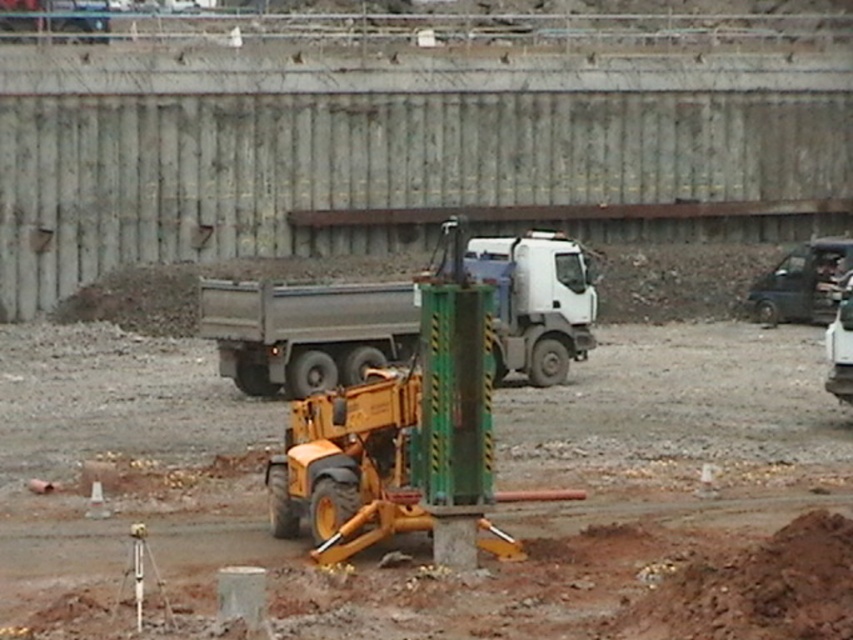
Question: Can you confirm if gray metallic trailer truck at center is positioned to the right of black fabric construction worker at right?

Choices:
 (A) no
 (B) yes

Answer: (A)

Question: Among these points, which one is nearest to the camera?

Choices:
 (A) (299, 294)
 (B) (840, 268)

Answer: (A)

Question: Which of the following is the farthest from the observer?

Choices:
 (A) gray metallic trailer truck at center
 (B) black fabric construction worker at right

Answer: (B)

Question: Which object is closer to the camera taking this photo?

Choices:
 (A) gray metallic trailer truck at center
 (B) black fabric construction worker at right

Answer: (A)

Question: Does gray metallic trailer truck at center appear on the left side of black fabric construction worker at right?

Choices:
 (A) yes
 (B) no

Answer: (A)

Question: Can you confirm if gray metallic trailer truck at center is positioned below black fabric construction worker at right?

Choices:
 (A) yes
 (B) no

Answer: (A)